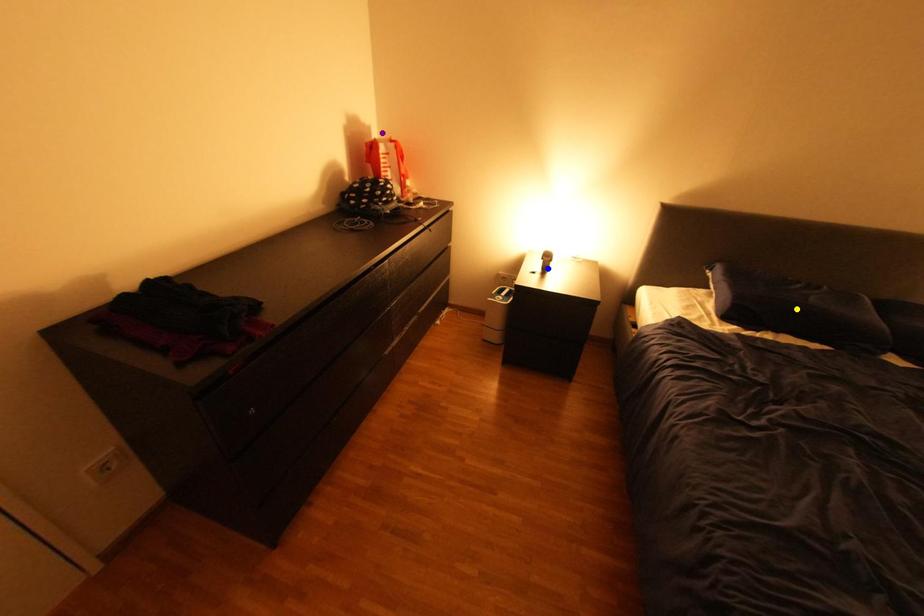
Order these from nearest to farthest:
blue point, yellow point, purple point

yellow point → purple point → blue point